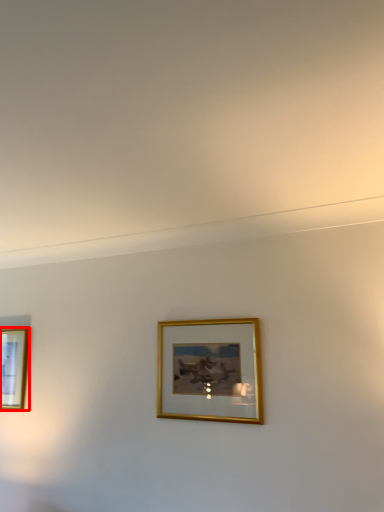
Question: From the image's perspective, what is the correct spatial positioning of picture frame (annotated by the red box) in reference to picture frame?

Choices:
 (A) above
 (B) below

Answer: (B)